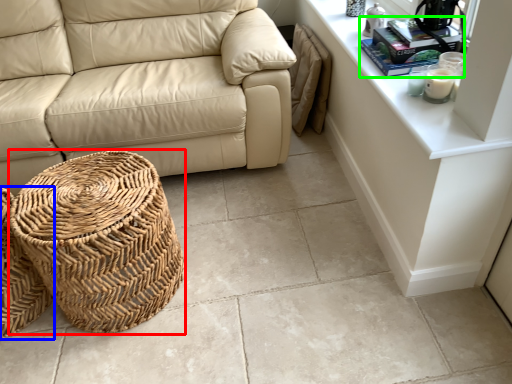
Question: Considering the real-world distances, which object is farthest from basket (highlighted by a red box)? basket (highlighted by a blue box) or book (highlighted by a green box)?

Choices:
 (A) basket
 (B) book

Answer: (B)